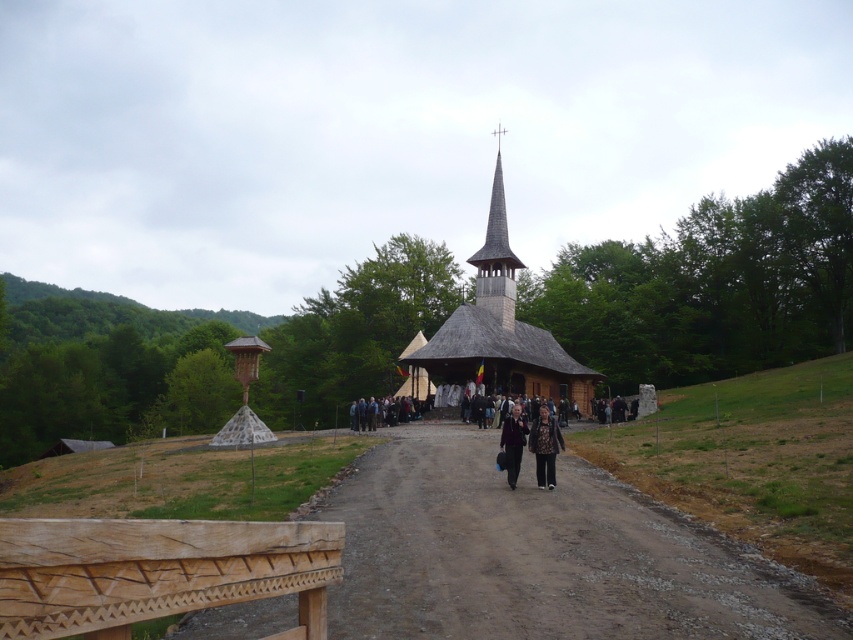
Question: Which of the following is the closest to the observer?

Choices:
 (A) wooden church at center
 (B) wooden gazebo at left
 (C) wooden spire at center
 (D) patterned fabric coat at center

Answer: (D)

Question: Does wooden spire at center have a lesser width compared to patterned fabric coat at center?

Choices:
 (A) no
 (B) yes

Answer: (A)

Question: Which object appears farthest from the camera in this image?

Choices:
 (A) brown dirt track at center
 (B) patterned fabric coat at center

Answer: (B)

Question: Which is nearer to the wooden gazebo at left?

Choices:
 (A) dark brown leather jacket at center
 (B) wooden church at center
 (C) patterned fabric coat at center

Answer: (B)

Question: Is wooden spire at center behind patterned fabric coat at center?

Choices:
 (A) yes
 (B) no

Answer: (A)

Question: Does brown dirt track at center have a lesser width compared to dark brown leather jacket at center?

Choices:
 (A) yes
 (B) no

Answer: (B)